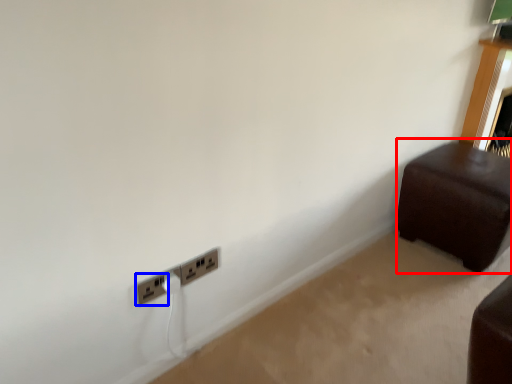
Question: Which object appears farthest to the camera in this image, furniture (highlighted by a red box) or power plugs and sockets (highlighted by a blue box)?

Choices:
 (A) furniture
 (B) power plugs and sockets

Answer: (A)